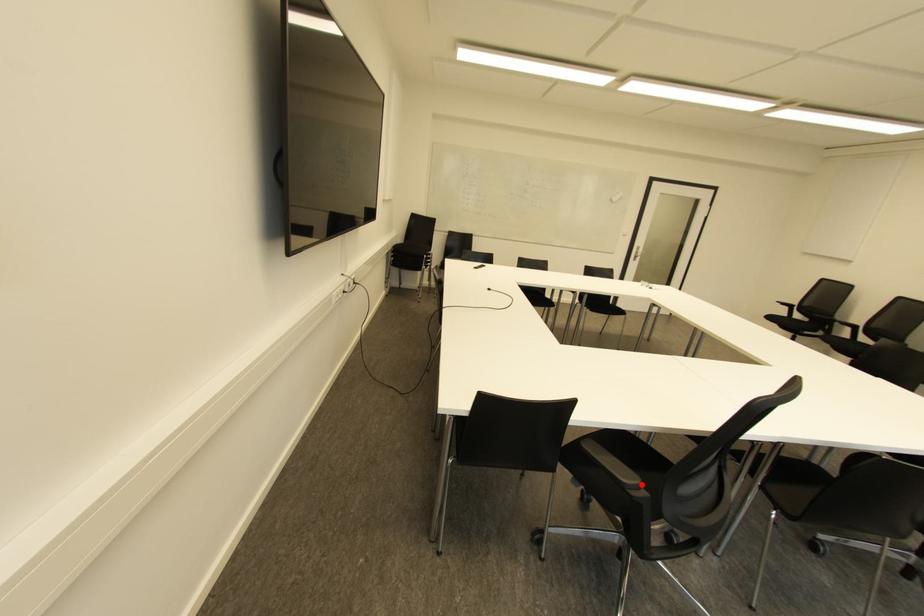
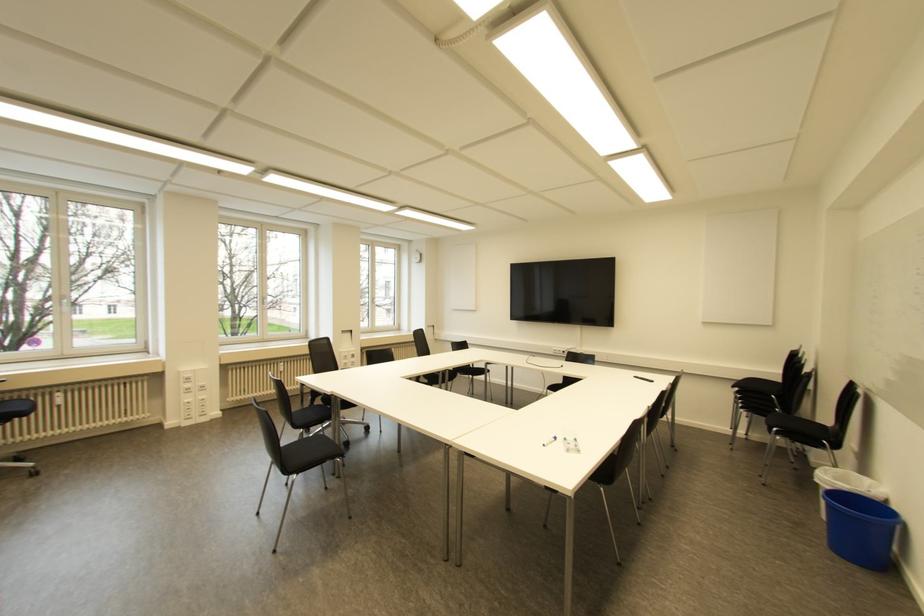
Question: I am providing you with two images of the same scene from different viewpoints. A red point is marked on the first image. Is the red point's position out of view in image 2?

Choices:
 (A) Yes
 (B) No

Answer: (A)